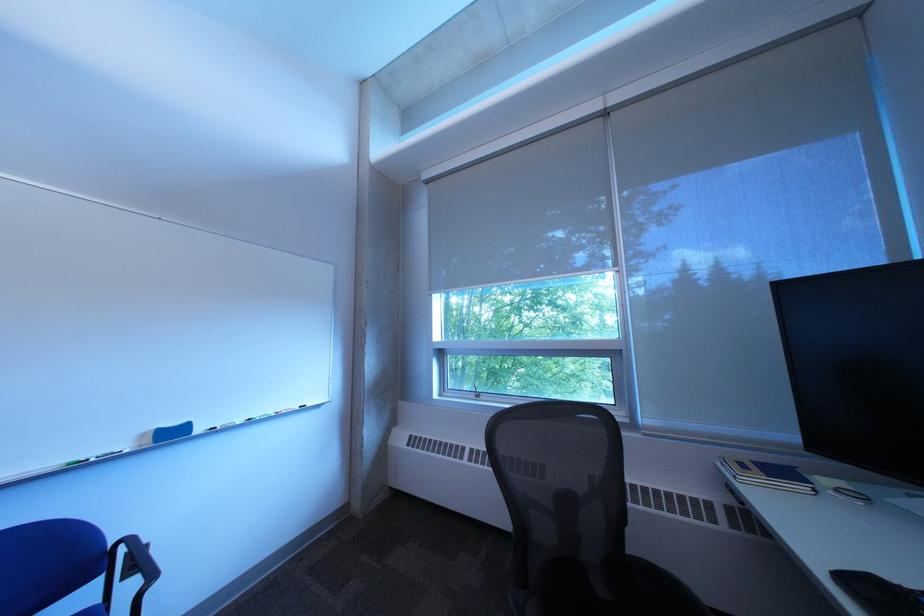
Where would you writ the whiteboard marker? Please return your answer as a coordinate pair (x, y).

(238, 422)